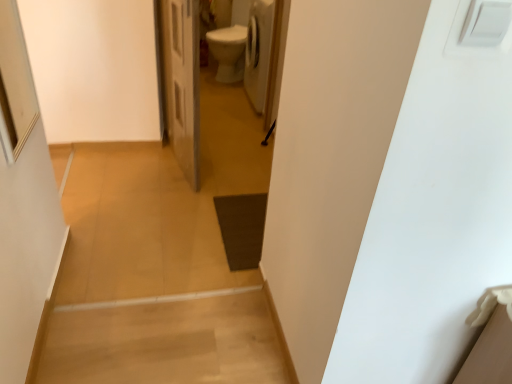
Question: From a real-world perspective, is white plastic switch at upper right physically located above or below white glossy door at center?

Choices:
 (A) above
 (B) below

Answer: (A)

Question: In terms of size, does white plastic switch at upper right appear bigger or smaller than white glossy door at center?

Choices:
 (A) small
 (B) big

Answer: (A)

Question: Does point tap(466, 54) appear closer or farther from the camera than point tap(180, 11)?

Choices:
 (A) farther
 (B) closer

Answer: (B)

Question: Is point (193, 54) positioned closer to the camera than point (446, 44)?

Choices:
 (A) closer
 (B) farther

Answer: (B)

Question: Based on their positions, is white glossy door at center located to the left or right of white plastic switch at upper right?

Choices:
 (A) left
 (B) right

Answer: (A)

Question: Considering their positions, is white glossy door at center located in front of or behind white plastic switch at upper right?

Choices:
 (A) front
 (B) behind

Answer: (B)

Question: In terms of width, does white glossy door at center look wider or thinner when compared to white plastic switch at upper right?

Choices:
 (A) thin
 (B) wide

Answer: (B)